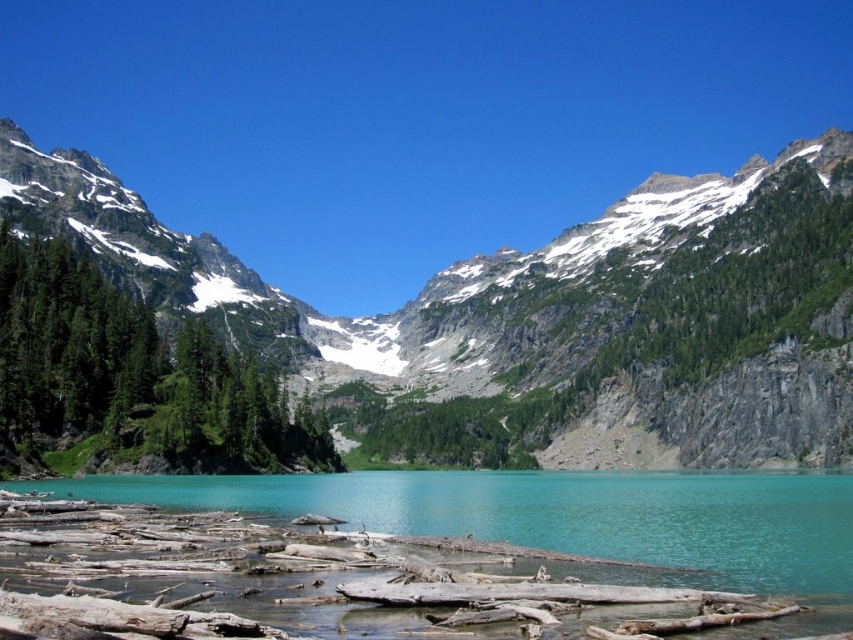
Question: Which object appears farthest from the camera in this image?

Choices:
 (A) snowy granite mountain at center
 (B) green matte tree at left

Answer: (A)

Question: Does snowy granite mountain at center appear under turquoise glassy water at center?

Choices:
 (A) no
 (B) yes

Answer: (A)

Question: Observing the image, what is the correct spatial positioning of snowy granite mountain at center in reference to turquoise glassy water at center?

Choices:
 (A) left
 (B) right

Answer: (A)

Question: Which point is closer to the camera?

Choices:
 (A) (137, 352)
 (B) (730, 362)

Answer: (A)

Question: Considering the real-world distances, which object is farthest from the snowy granite mountain at center?

Choices:
 (A) green matte tree at left
 (B) turquoise glassy water at center

Answer: (B)

Question: Can you confirm if snowy granite mountain at center is bigger than green matte tree at left?

Choices:
 (A) yes
 (B) no

Answer: (A)